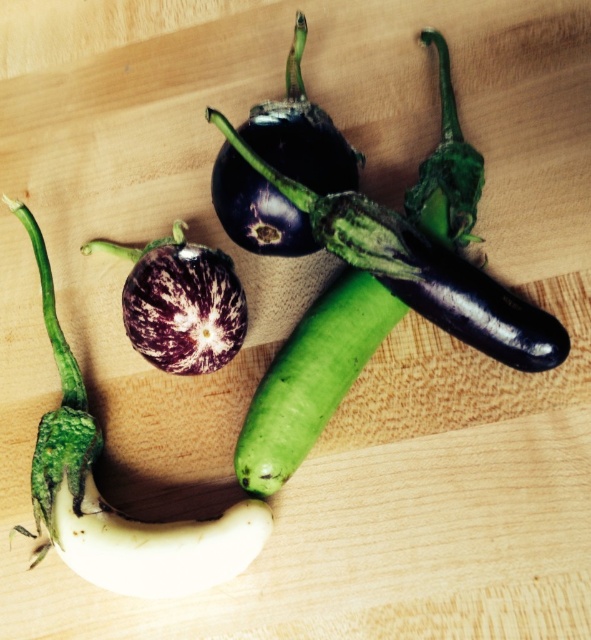
Question: Can you confirm if shiny purple eggplant at center is smaller than purple glossy eggplant at center?

Choices:
 (A) yes
 (B) no

Answer: (B)

Question: Which of the following is the farthest from the observer?

Choices:
 (A) (379, 339)
 (B) (313, 138)

Answer: (B)

Question: Can you confirm if white matte eggplant at center is positioned to the left of shiny purple eggplant at center?

Choices:
 (A) no
 (B) yes

Answer: (B)

Question: Which object is closer to the camera taking this photo?

Choices:
 (A) shiny purple eggplant at center
 (B) green smooth cucumber at center
 (C) purple glossy eggplant at center
 (D) white matte eggplant at center

Answer: (D)

Question: Is shiny purple eggplant at center above purple striped eggplant at center?

Choices:
 (A) no
 (B) yes

Answer: (B)

Question: Which of these objects is positioned farthest from the green smooth cucumber at center?

Choices:
 (A) purple striped eggplant at center
 (B) purple glossy eggplant at center

Answer: (B)